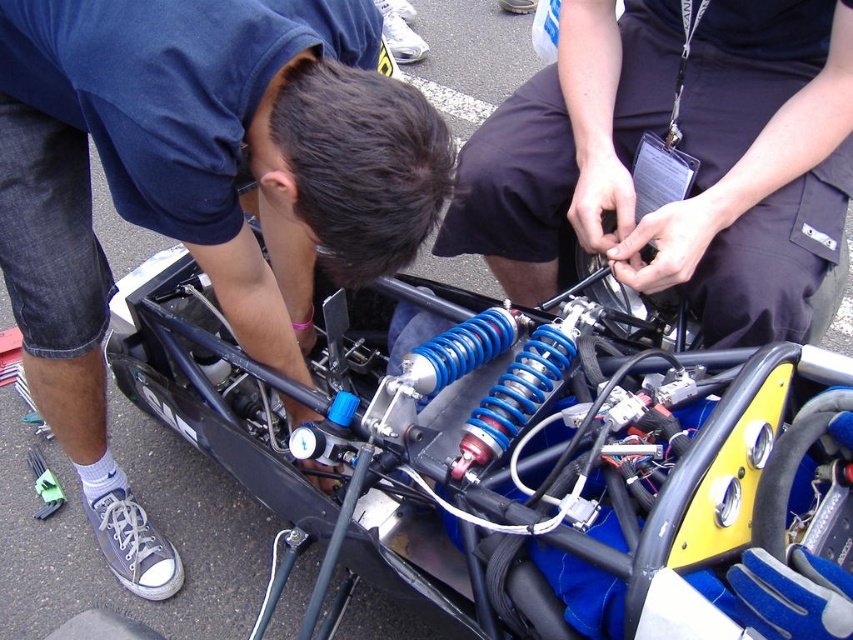
Question: Which object is positioned farthest from the blue metallic suspension at center?

Choices:
 (A) blue rubber hose at center
 (B) blue metallic coil at center

Answer: (A)

Question: Is the position of blue metallic suspension at center less distant than that of blue metallic coil at center?

Choices:
 (A) yes
 (B) no

Answer: (A)

Question: Does blue metallic coil at center have a larger size compared to blue rubber hose at center?

Choices:
 (A) yes
 (B) no

Answer: (A)

Question: Which point is closer to the camera taking this photo?

Choices:
 (A) (257, 259)
 (B) (631, 636)

Answer: (B)

Question: Among these points, which one is farthest from the camera?

Choices:
 (A) (824, 540)
 (B) (614, 28)
 (C) (350, 195)

Answer: (B)

Question: Considering the relative positions of blue metallic suspension at center and blue rubber hose at center in the image provided, where is blue metallic suspension at center located with respect to blue rubber hose at center?

Choices:
 (A) above
 (B) below

Answer: (B)